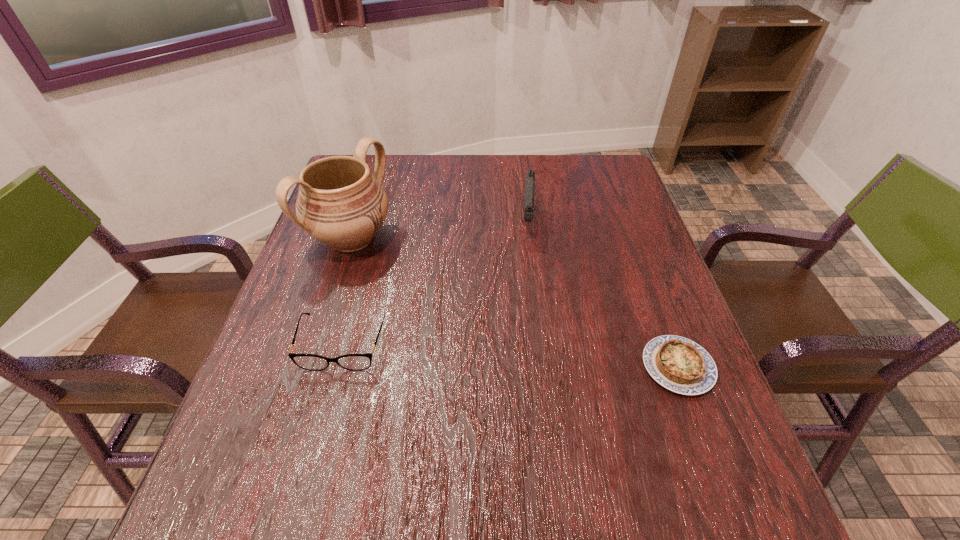
This screenshot has width=960, height=540. In order to click on vacant space that satisfies the following two spatial constraints: 1. on the front side of the urn; 2. on the right side of the rightmost object in this screenshot , I will do `click(311, 367)`.